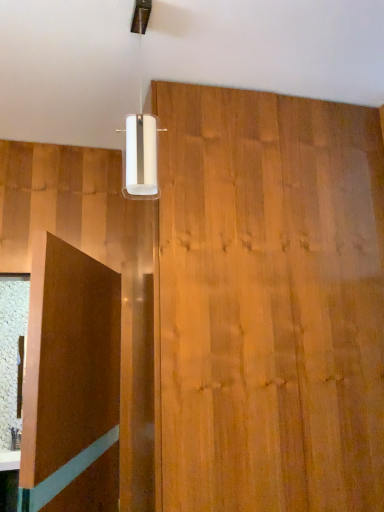
What do you see at coordinates (140, 129) in the screenshot? The height and width of the screenshot is (512, 384). I see `white glossy lampshade at upper center` at bounding box center [140, 129].

In order to face white glossy lampshade at upper center, should I rotate leftwards or rightwards?

To align with it, rotate left about 6.961°.

Locate an element on the screen. white glossy lampshade at upper center is located at coordinates (140, 129).

At what (x,y) coordinates should I click in order to perform the action: click on white glossy lampshade at upper center. Please return your answer as a coordinate pair (x, y). The width and height of the screenshot is (384, 512). Looking at the image, I should click on (140, 129).